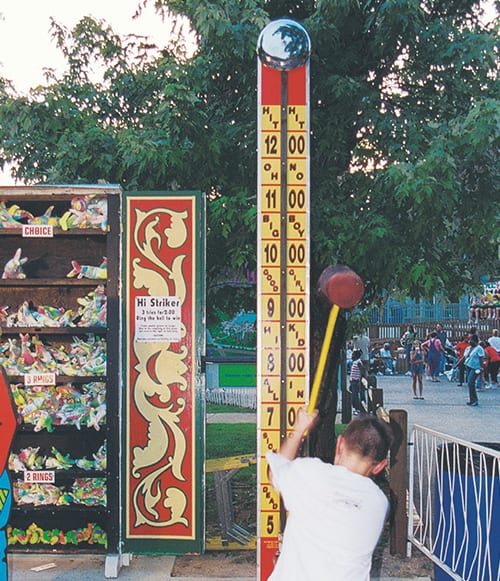
Find the location of a particular element. yellow table is located at coordinates (223, 465).